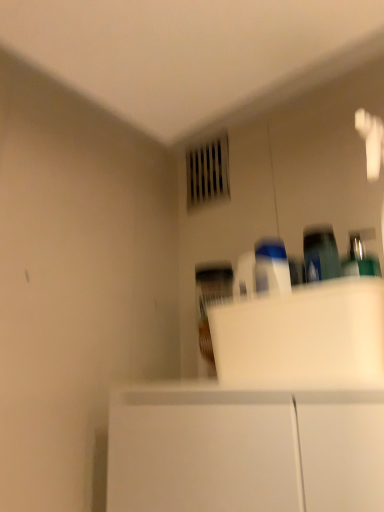
What do you see at coordinates (303, 337) in the screenshot? I see `white matte cabinet at center` at bounding box center [303, 337].

This screenshot has height=512, width=384. In order to click on white matte cabinet at center in this screenshot , I will do `click(303, 337)`.

Identify the location of white matte cabinet at center. This screenshot has height=512, width=384. (303, 337).